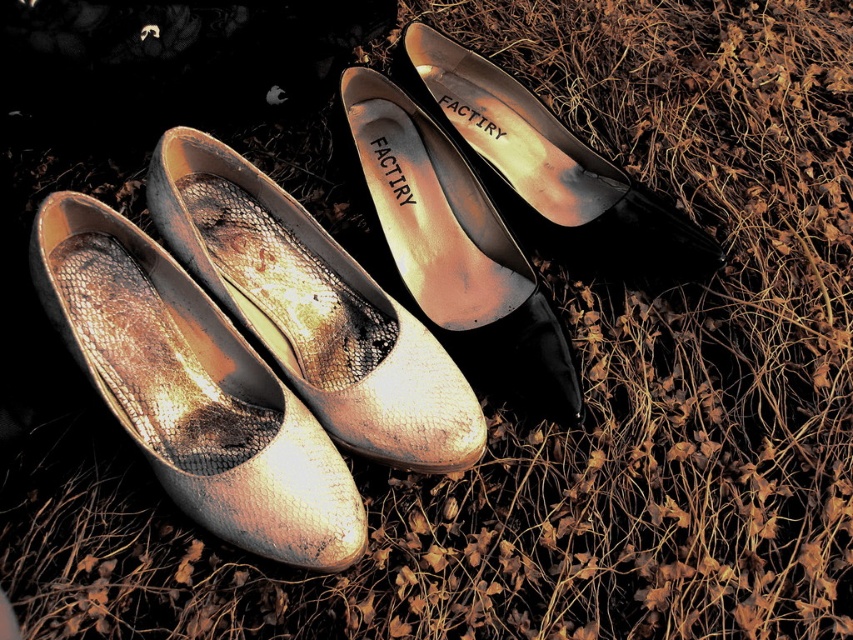
Which is behind, point (560, 417) or point (621, 262)?

Positioned behind is point (621, 262).

Does metallic leather shoe at center have a greater height compared to metallic gold shoe at upper center?

Correct, metallic leather shoe at center is much taller as metallic gold shoe at upper center.

Locate an element on the screen. This screenshot has width=853, height=640. metallic leather shoe at center is located at coordinates (456, 248).

Who is shorter, metallic gold shoe at center or metallic leather shoe at center?

With less height is metallic gold shoe at center.

Does point (213, 452) lie behind point (397, 252)?

No.

Is point (213, 460) farther from camera compared to point (393, 122)?

No, it is not.

Image resolution: width=853 pixels, height=640 pixels. What are the coordinates of `metallic gold shoe at center` in the screenshot? It's located at click(192, 388).

Is metallic gold shoe at center to the right of metallic gold shoe at upper center from the viewer's perspective?

In fact, metallic gold shoe at center is to the left of metallic gold shoe at upper center.

Between point (310, 536) and point (544, 166), which one is positioned behind?

Point (544, 166)

Is point (286, 448) more distant than point (448, 68)?

No.

This screenshot has height=640, width=853. I want to click on metallic gold shoe at center, so click(192, 388).